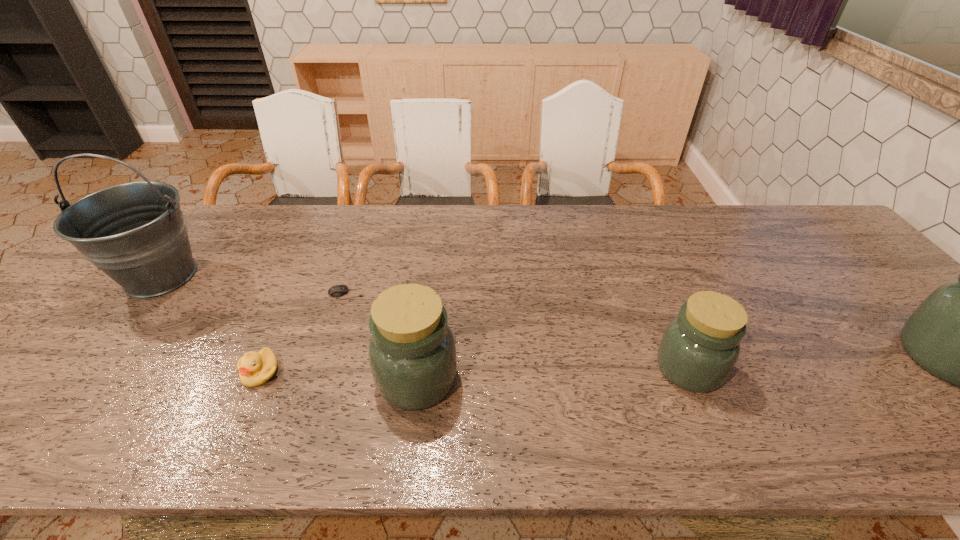
Where is `free spot at the left edge of the desktop`? free spot at the left edge of the desktop is located at coordinates (79, 314).

At what (x,y) coordinates should I click in order to perform the action: click on unoccupied position between the duckling and the tallest object. Please return your answer as a coordinate pair (x, y). The image size is (960, 540). Looking at the image, I should click on (211, 323).

Image resolution: width=960 pixels, height=540 pixels. What are the coordinates of `free space that is in between the tallest object and the fifth object from right to left` in the screenshot? It's located at (211, 323).

Where is `free point between the bucket and the leftmost jar`? The width and height of the screenshot is (960, 540). free point between the bucket and the leftmost jar is located at coordinates (289, 327).

Locate an element on the screen. This screenshot has width=960, height=540. free space that is in between the leftmost jar and the third shortest object is located at coordinates (553, 373).

In order to click on free space between the second object from right to left and the third object from right to left in this screenshot , I will do `click(553, 373)`.

Where is `free area in between the fifth tallest object and the bucket`? free area in between the fifth tallest object and the bucket is located at coordinates (211, 323).

You are a GUI agent. You are given a task and a screenshot of the screen. Output one action in this format:
    pyautogui.click(x=<x>, y=<y>)
    Task: Click on the vacant space that's between the tallest object and the mouse
    The width and height of the screenshot is (960, 540).
    Given the screenshot: What is the action you would take?
    pyautogui.click(x=253, y=285)

Choose which object is the nearest neighbor to the leftmost jar. Please provide its 2D coordinates. Your answer should be formatted as a tuple, i.e. [(x, y)], where the tuple contains the x and y coordinates of a point satisfying the conditions above.

[(338, 290)]

Choose which object is the second nearest neighbor to the second jar from right to left. Please provide its 2D coordinates. Your answer should be formatted as a tuple, i.e. [(x, y)], where the tuple contains the x and y coordinates of a point satisfying the conditions above.

[(412, 353)]